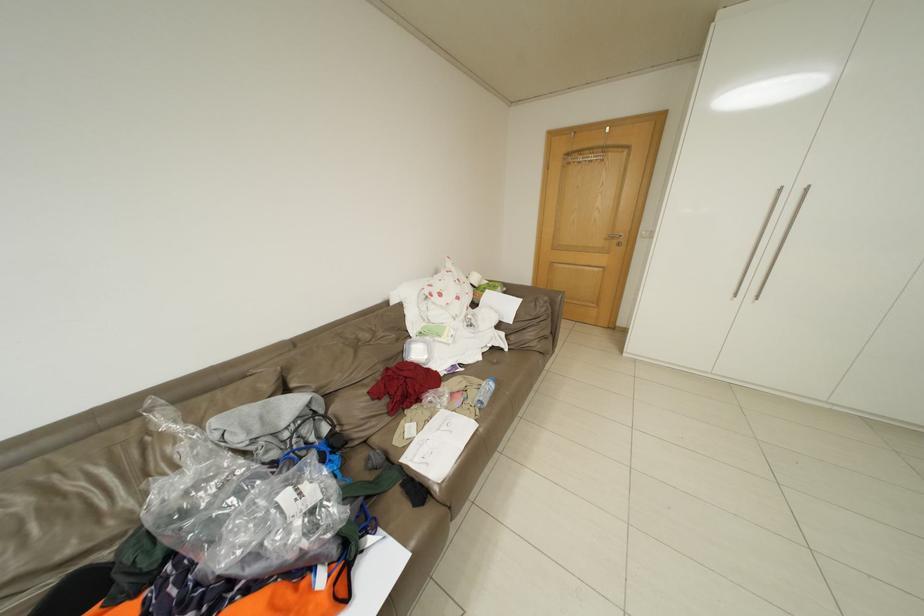
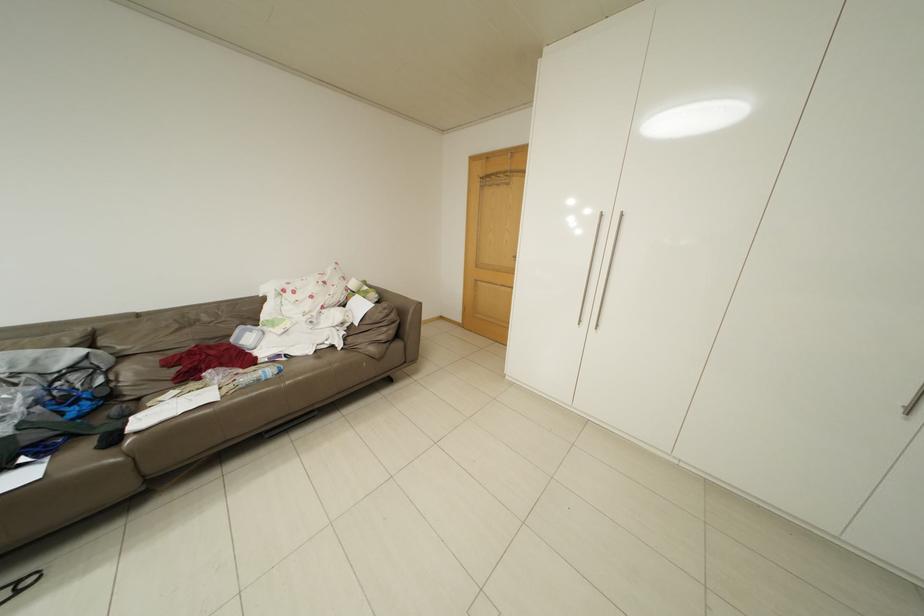
Question: What movement of the cameraman would produce the second image?

Choices:
 (A) Left
 (B) Right
 (C) Forward
 (D) Backward

Answer: (B)